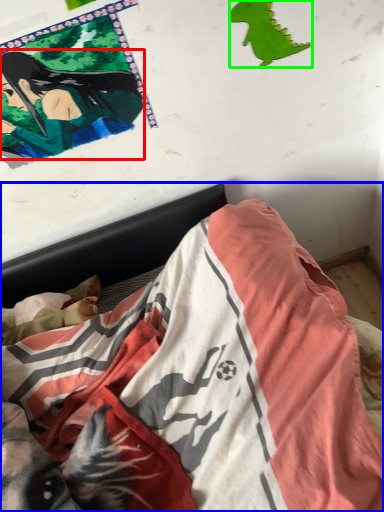
Question: Based on their relative distances, which object is farther from person (highlighted by a red box)? Choose from bed (highlighted by a blue box) and print (highlighted by a green box).

Choices:
 (A) bed
 (B) print

Answer: (A)